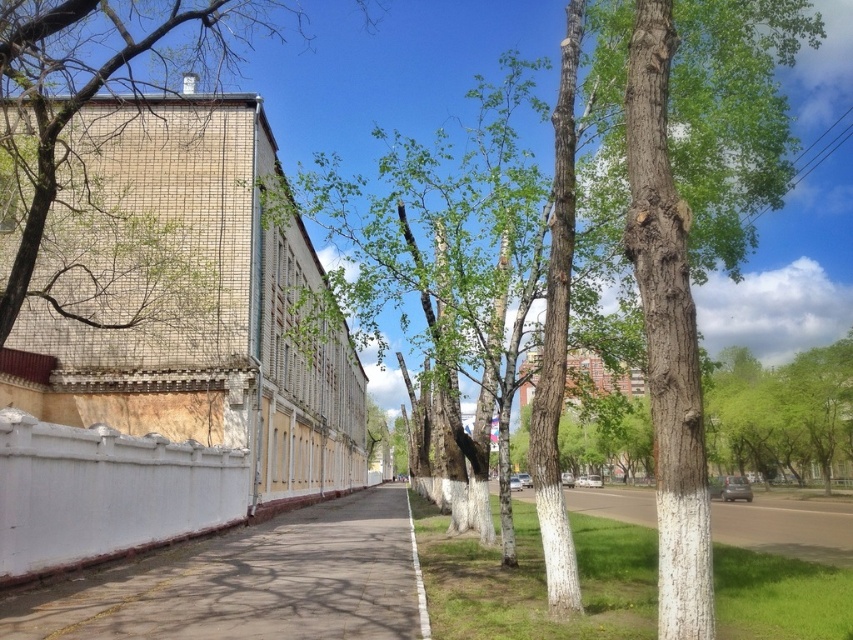
Question: Does white concrete pavement at center appear on the right side of green grass at lower center?

Choices:
 (A) no
 (B) yes

Answer: (A)

Question: Which point appears closest to the camera in this image?

Choices:
 (A) (100, 435)
 (B) (851, 563)
 (C) (273, 561)

Answer: (A)

Question: Which point appears closest to the camera in this image?

Choices:
 (A) (270, 554)
 (B) (650, 502)

Answer: (A)

Question: Does green leafy tree at upper left have a larger size compared to green grass at lower center?

Choices:
 (A) yes
 (B) no

Answer: (A)

Question: From the image, what is the correct spatial relationship of white smooth fence at lower left in relation to green grass at lower center?

Choices:
 (A) above
 (B) below

Answer: (A)

Question: Based on their relative distances, which object is farther from the white concrete pavement at center?

Choices:
 (A) green grass at lower center
 (B) white smooth fence at lower left

Answer: (A)